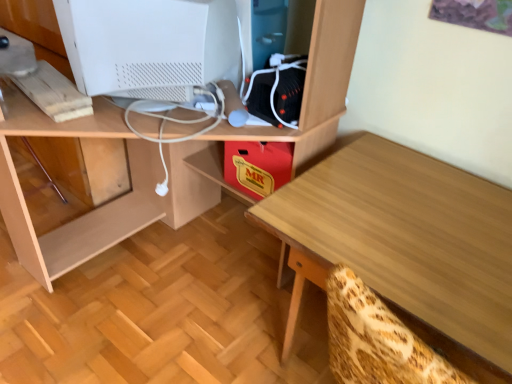
Where is `vacant area situated below wooden desk at center (from a real-world perspective)`? The image size is (512, 384). vacant area situated below wooden desk at center (from a real-world perspective) is located at coordinates tap(177, 268).